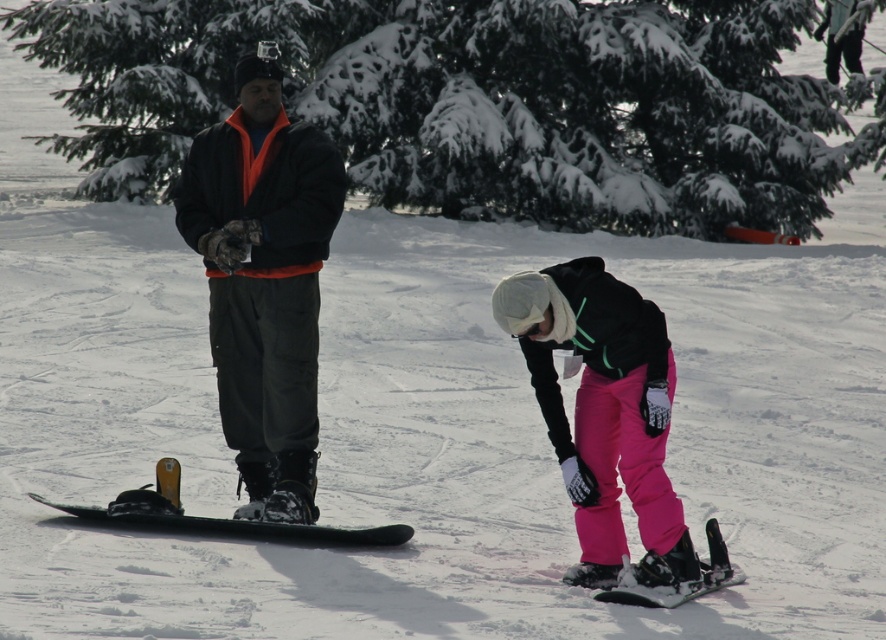
From the picture: Does matte black snowboard at left have a larger size compared to matte pink pants at lower center?

Indeed, matte black snowboard at left has a larger size compared to matte pink pants at lower center.

Is matte black snowboard at left to the right of matte pink pants at lower center from the viewer's perspective?

Incorrect, matte black snowboard at left is not on the right side of matte pink pants at lower center.

Is point (243, 99) positioned after point (628, 317)?

Yes, it is.

Locate an element on the screen. Image resolution: width=886 pixels, height=640 pixels. matte black snowboard at left is located at coordinates (603, 410).

In the scene shown: Does green textured pine tree at upper center appear on the right side of black matte snowboard at center?

Yes, green textured pine tree at upper center is to the right of black matte snowboard at center.

Is green textured pine tree at upper center taller than black matte snowboard at center?

Yes.

Is point (573, 138) positioned after point (253, 456)?

Yes.

Identify the location of green textured pine tree at upper center. The width and height of the screenshot is (886, 640). (473, 102).

Is matte pink pants at lower center shorter than green matte snowboard at center?

In fact, matte pink pants at lower center may be taller than green matte snowboard at center.

Which is behind, point (639, 496) or point (158, 518)?

The point (158, 518) is behind.

Does point (572, 452) come in front of point (92, 512)?

Yes, it is.

Find the location of a particular element. matte pink pants at lower center is located at coordinates (604, 412).